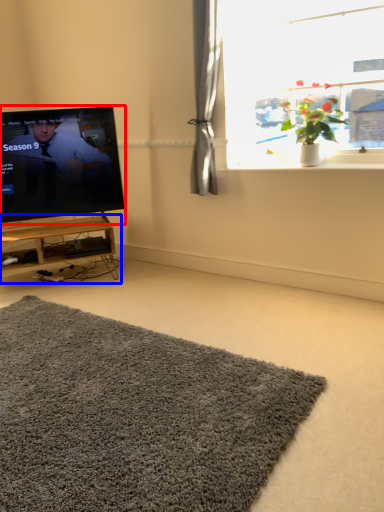
Question: Which object appears closest to the camera in this image, television (highlighted by a red box) or table (highlighted by a blue box)?

Choices:
 (A) television
 (B) table

Answer: (A)